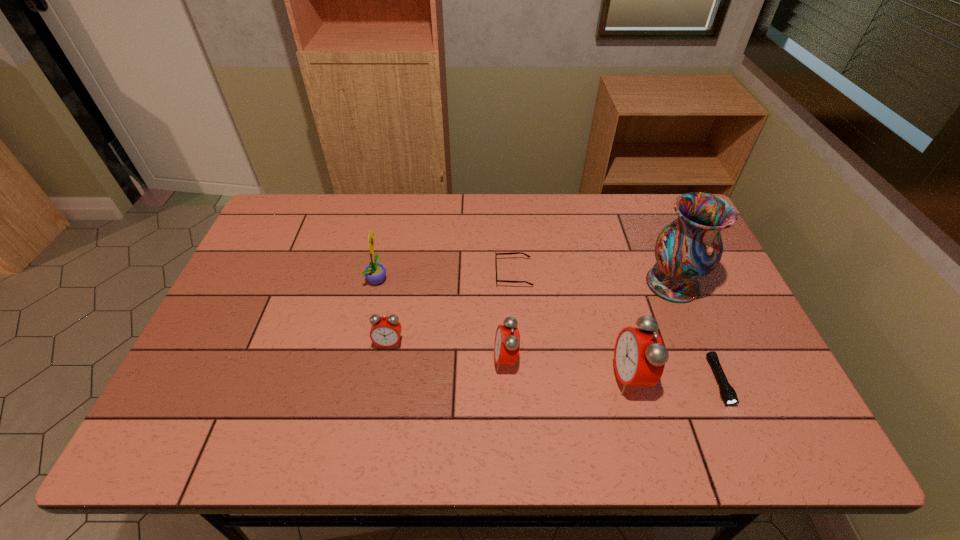
What are the coordinates of `the leftmost alarm clock` in the screenshot? It's located at (386, 330).

The width and height of the screenshot is (960, 540). In order to click on the third shortest object in this screenshot , I will do `click(386, 330)`.

Where is `the second shortest alarm clock`? Image resolution: width=960 pixels, height=540 pixels. the second shortest alarm clock is located at coordinates (507, 339).

Image resolution: width=960 pixels, height=540 pixels. In order to click on the second alarm clock from right to left in this screenshot , I will do `click(507, 339)`.

Find the location of a particular element. The height and width of the screenshot is (540, 960). the rightmost alarm clock is located at coordinates (639, 359).

Identify the location of the fifth object from left to right. This screenshot has width=960, height=540. (639, 359).

Where is `vase`? vase is located at coordinates (689, 248).

Where is `sunglasses`? The image size is (960, 540). sunglasses is located at coordinates (496, 254).

This screenshot has width=960, height=540. I want to click on sunflower, so click(375, 273).

Where is `flashlight`? Image resolution: width=960 pixels, height=540 pixels. flashlight is located at coordinates (728, 393).